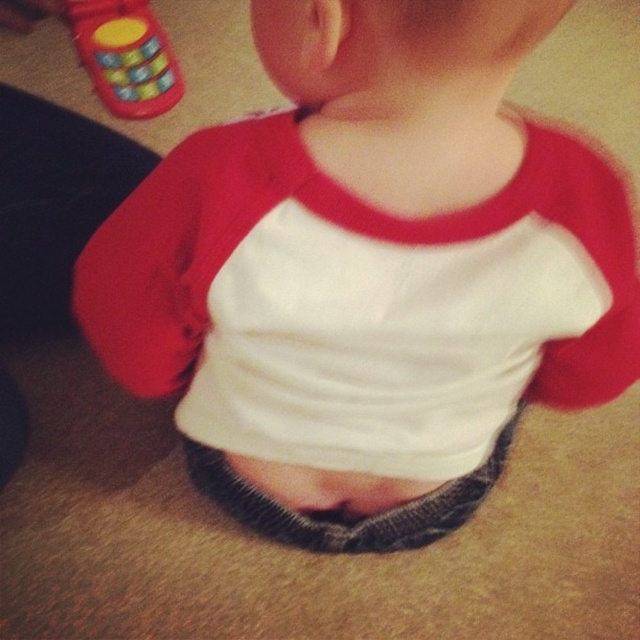
Question: Can you confirm if rubberized plastic phone at upper left is positioned below gray knitted fabric at center?

Choices:
 (A) no
 (B) yes

Answer: (A)

Question: Which object appears closest to the camera in this image?

Choices:
 (A) gray knitted fabric at center
 (B) rubberized plastic phone at upper left

Answer: (A)

Question: Which point is farther to the camera?

Choices:
 (A) gray knitted fabric at center
 (B) rubberized plastic phone at upper left

Answer: (B)

Question: Does rubberized plastic phone at upper left have a lesser width compared to gray knitted fabric at center?

Choices:
 (A) no
 (B) yes

Answer: (A)

Question: Is rubberized plastic phone at upper left smaller than gray knitted fabric at center?

Choices:
 (A) no
 (B) yes

Answer: (A)